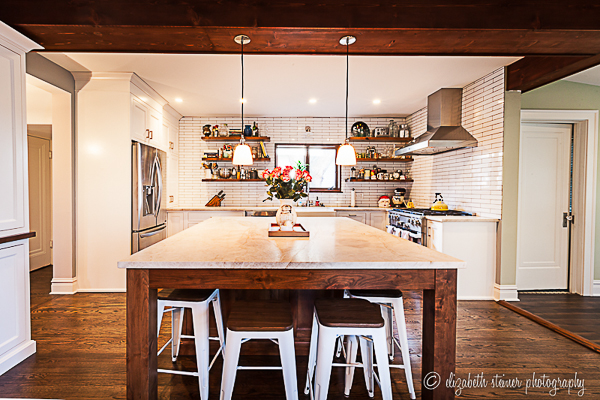
Image resolution: width=600 pixels, height=400 pixels. In order to click on kitchen shelf in this screenshot , I will do `click(219, 180)`, `click(219, 160)`, `click(218, 137)`, `click(367, 181)`, `click(370, 159)`, `click(368, 138)`.